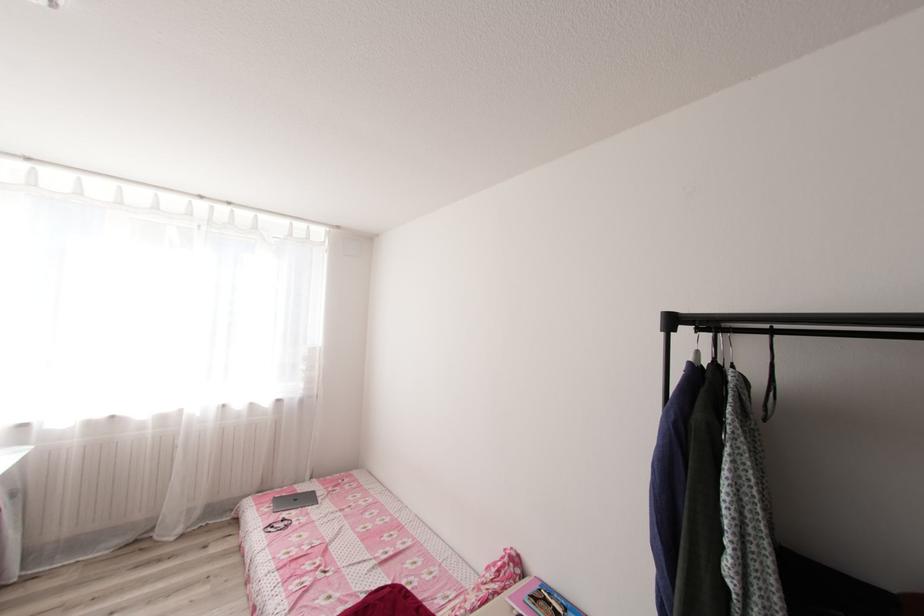
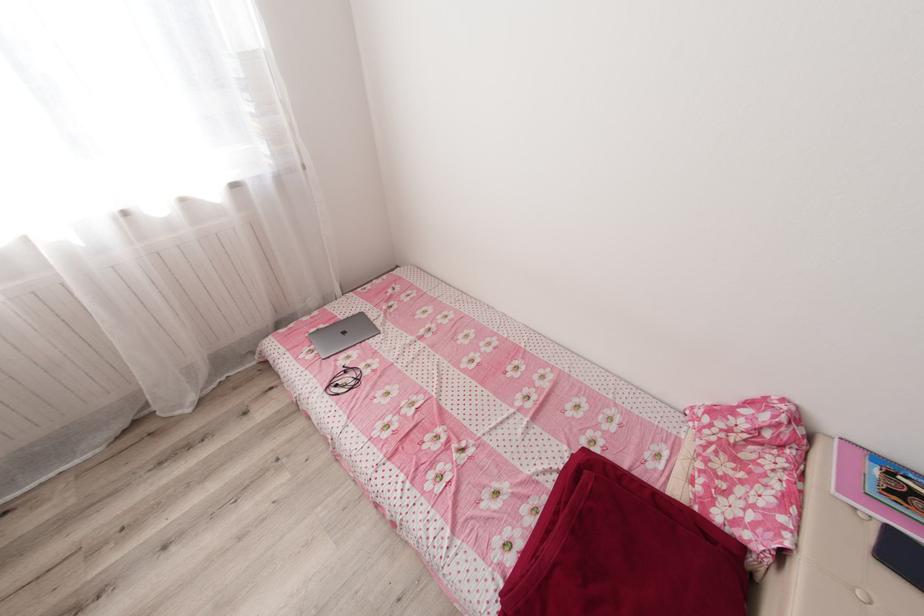
Locate, in the second image, the point that corresponds to point (318, 493) in the first image.

(367, 315)